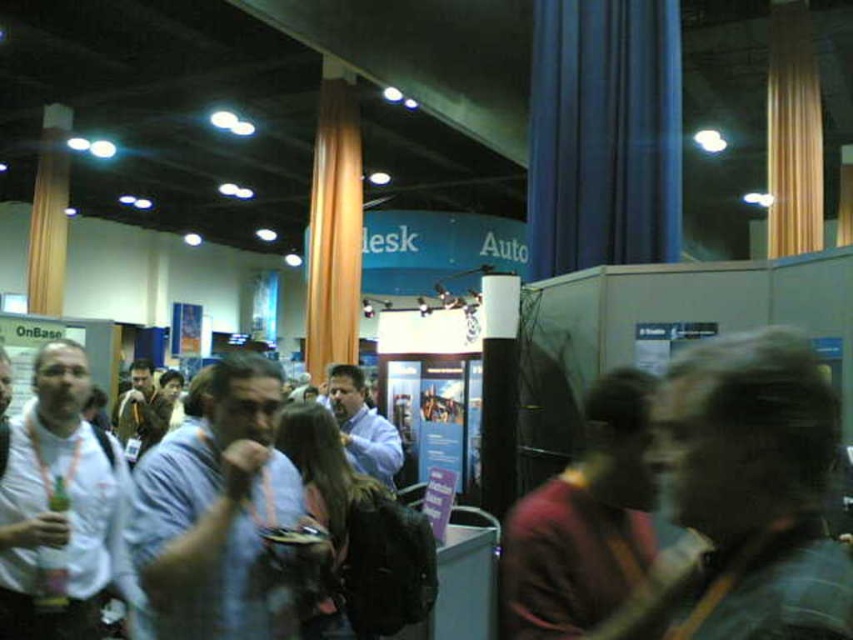
Question: Among these objects, which one is farthest from the camera?

Choices:
 (A) white matte shirt at left
 (B) light blue shirt at center
 (C) maroon fabric shirt at center

Answer: (A)

Question: Can you confirm if white matte shirt at left is bigger than maroon fabric shirt at center?

Choices:
 (A) yes
 (B) no

Answer: (A)

Question: Which object is farther from the camera taking this photo?

Choices:
 (A) light blue shirt at center
 (B) white matte shirt at left

Answer: (B)

Question: Does light blue shirt at center appear under maroon fabric shirt at center?

Choices:
 (A) no
 (B) yes

Answer: (B)

Question: Can you confirm if light blue shirt at center is positioned below maroon fabric shirt at center?

Choices:
 (A) yes
 (B) no

Answer: (A)

Question: Which point appears closest to the camera in this image?

Choices:
 (A) (596, 596)
 (B) (38, 412)
 (C) (241, 577)

Answer: (A)